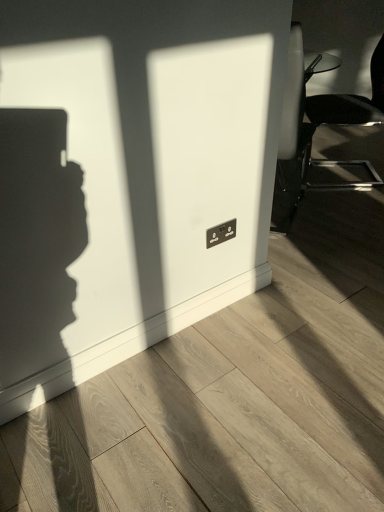
Describe the element at coordinates (322, 117) in the screenshot. I see `metallic silver chair at right` at that location.

You are a GUI agent. You are given a task and a screenshot of the screen. Output one action in this format:
    pyautogui.click(x=<x>, y=<y>)
    Task: Click on the metallic silver chair at right
    The width and height of the screenshot is (384, 512).
    Given the screenshot: What is the action you would take?
    pyautogui.click(x=322, y=117)

In order to face black plastic electric outlet at center, should I rotate leftwards or rightwards?

Rotate right and turn 3.802 degrees.

Where is `black plastic electric outlet at center`? black plastic electric outlet at center is located at coordinates (220, 233).

The image size is (384, 512). What do you see at coordinates (220, 233) in the screenshot? I see `black plastic electric outlet at center` at bounding box center [220, 233].

Locate an element on the screen. Image resolution: width=384 pixels, height=512 pixels. metallic silver chair at right is located at coordinates (322, 117).

Is black plastic electric outlet at center at the right side of metallic silver chair at right?

Incorrect, black plastic electric outlet at center is not on the right side of metallic silver chair at right.

Considering the positions of objects black plastic electric outlet at center and metallic silver chair at right in the image provided, who is in front, black plastic electric outlet at center or metallic silver chair at right?

black plastic electric outlet at center is more forward.

Between point (234, 231) and point (285, 129), which one is positioned behind?

The point (285, 129) is farther from the camera.

From the image's perspective, would you say black plastic electric outlet at center is shown under metallic silver chair at right?

Yes, from the image's perspective, black plastic electric outlet at center is beneath metallic silver chair at right.

Based on the photo, from a real-world perspective, is black plastic electric outlet at center above or below metallic silver chair at right?

In terms of real-world spatial position, black plastic electric outlet at center is below metallic silver chair at right.

In terms of width, does black plastic electric outlet at center look wider or thinner when compared to metallic silver chair at right?

Considering their sizes, black plastic electric outlet at center looks slimmer than metallic silver chair at right.

Can you confirm if black plastic electric outlet at center is shorter than metallic silver chair at right?

Indeed, black plastic electric outlet at center has a lesser height compared to metallic silver chair at right.

Looking at this image, is black plastic electric outlet at center bigger than metallic silver chair at right?

Incorrect, black plastic electric outlet at center is not larger than metallic silver chair at right.

Which is correct: black plastic electric outlet at center is inside metallic silver chair at right, or outside of it?

black plastic electric outlet at center is outside metallic silver chair at right.

Is black plastic electric outlet at center next to metallic silver chair at right and touching it?

No, black plastic electric outlet at center is not touching metallic silver chair at right.

Is black plastic electric outlet at center turned away from metallic silver chair at right?

No, metallic silver chair at right is not at the back of black plastic electric outlet at center.

Can you tell me how much black plastic electric outlet at center and metallic silver chair at right differ in facing direction?

131 degrees separate the facing orientations of black plastic electric outlet at center and metallic silver chair at right.

You are a GUI agent. You are given a task and a screenshot of the screen. Output one action in this format:
    pyautogui.click(x=<x>, y=<y>)
    Task: Click on the chair lying on the right of black plastic electric outlet at center
    This screenshot has width=384, height=512.
    Given the screenshot: What is the action you would take?
    pyautogui.click(x=322, y=117)

Which is more to the right, metallic silver chair at right or black plastic electric outlet at center?

From the viewer's perspective, metallic silver chair at right appears more on the right side.

Is metallic silver chair at right in front of black plastic electric outlet at center?

No, it is behind black plastic electric outlet at center.

Does point (292, 23) lie behind point (221, 234)?

That is True.

From the image's perspective, relative to black plastic electric outlet at center, is metallic silver chair at right above or below?

Clearly, from the image's perspective, metallic silver chair at right is above black plastic electric outlet at center.

From a real-world perspective, is metallic silver chair at right over black plastic electric outlet at center?

Yes, from a real-world perspective, metallic silver chair at right is above black plastic electric outlet at center.

Considering the relative sizes of metallic silver chair at right and black plastic electric outlet at center in the image provided, is metallic silver chair at right thinner than black plastic electric outlet at center?

No, metallic silver chair at right is not thinner than black plastic electric outlet at center.

Between metallic silver chair at right and black plastic electric outlet at center, which one has less height?

With less height is black plastic electric outlet at center.

Which of these two, metallic silver chair at right or black plastic electric outlet at center, is smaller?

With smaller size is black plastic electric outlet at center.

In the scene shown: Is black plastic electric outlet at center located within metallic silver chair at right?

No, black plastic electric outlet at center is not surrounded by metallic silver chair at right.

Is metallic silver chair at right touching black plastic electric outlet at center?

No, metallic silver chair at right is not making contact with black plastic electric outlet at center.

Is metallic silver chair at right positioned with its back to black plastic electric outlet at center?

No, black plastic electric outlet at center is not at the back of metallic silver chair at right.

Where is `chair positioned vertically above the black plastic electric outlet at center (from a real-world perspective)`? The width and height of the screenshot is (384, 512). chair positioned vertically above the black plastic electric outlet at center (from a real-world perspective) is located at coordinates coord(322,117).

You are a GUI agent. You are given a task and a screenshot of the screen. Output one action in this format:
    pyautogui.click(x=<x>, y=<y>)
    Task: Click on the chair located behind the black plastic electric outlet at center
    
    Given the screenshot: What is the action you would take?
    pyautogui.click(x=322, y=117)

The width and height of the screenshot is (384, 512). Find the location of `chair that is above the black plastic electric outlet at center (from the image's perspective)`. chair that is above the black plastic electric outlet at center (from the image's perspective) is located at coordinates (322, 117).